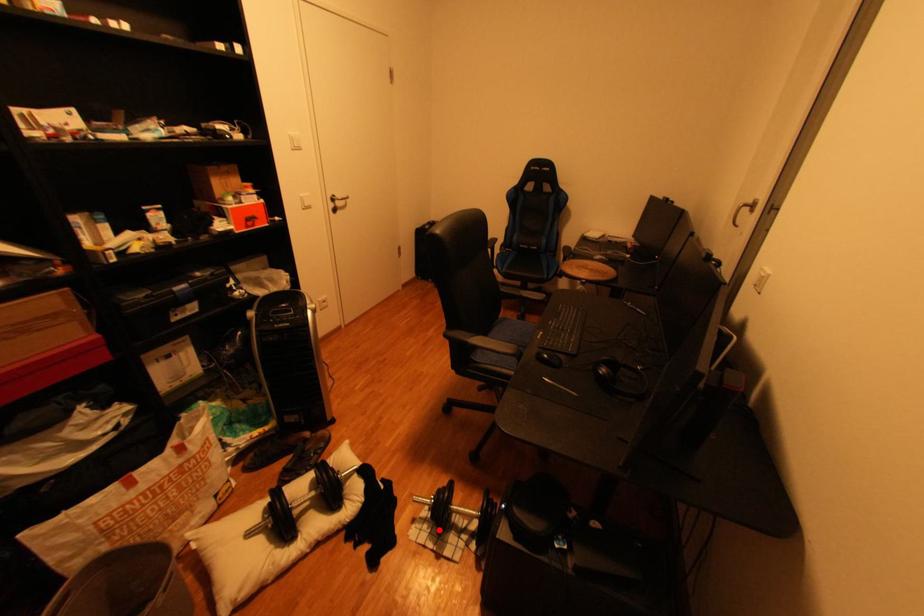
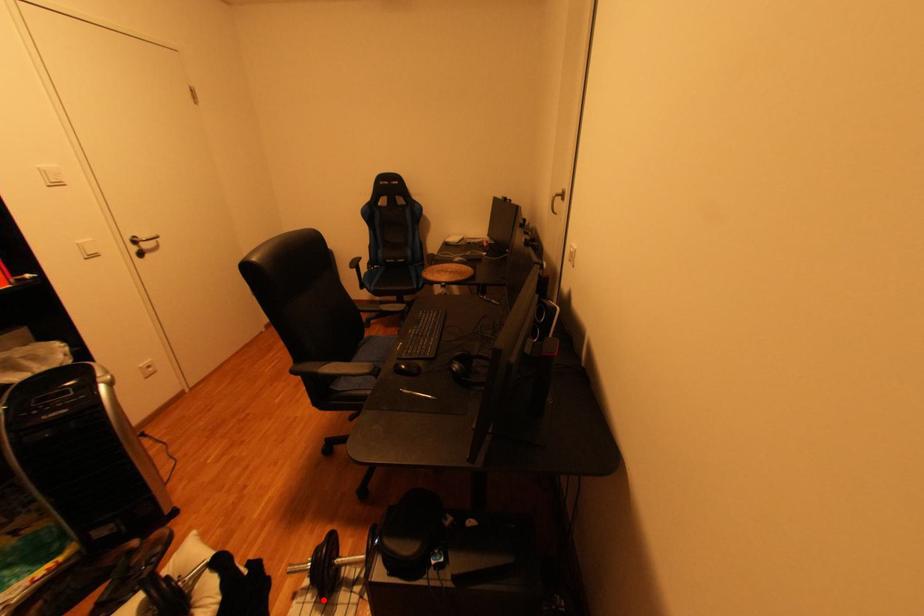
I am providing you with two images of the same scene from different viewpoints. A red point is marked on the first image and another point is marked on the second image. Do the highlighted points in image1 and image2 indicate the same real-world spot?

Yes